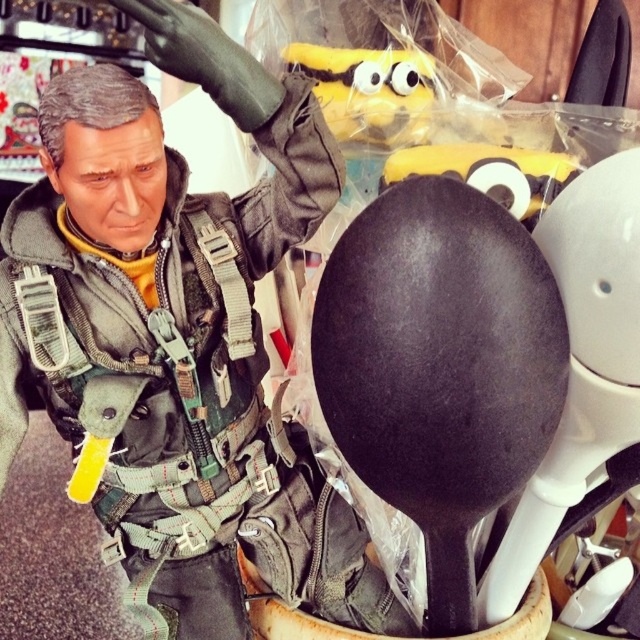
Does point (426, 556) lie in front of point (381, 64)?

Yes, it is.

Between black matte spoon at center and yellow plush toy at upper center, which one is positioned lower?

Positioned lower is black matte spoon at center.

Which is in front, point (384, 244) or point (408, 74)?

Point (384, 244)

The image size is (640, 640). Identify the location of black matte spoon at center. (440, 365).

Can you confirm if matte black helmet at upper right is smaller than black matte spoon at center?

No, matte black helmet at upper right is not smaller than black matte spoon at center.

Can you confirm if matte black helmet at upper right is positioned to the left of black matte spoon at center?

Correct, you'll find matte black helmet at upper right to the left of black matte spoon at center.

Does point (65, 280) come in front of point (492, 467)?

No, (65, 280) is behind (492, 467).

The height and width of the screenshot is (640, 640). In order to click on matte black helmet at upper right in this screenshot , I will do `click(179, 337)`.

Is point (154, 544) positioned behind point (416, 49)?

That is False.

Does matte black helmet at upper right appear on the left side of yellow plush toy at upper center?

Indeed, matte black helmet at upper right is positioned on the left side of yellow plush toy at upper center.

Which is behind, point (115, 348) or point (352, 74)?

Point (352, 74)

Locate an element on the screen. matte black helmet at upper right is located at coordinates pos(179,337).